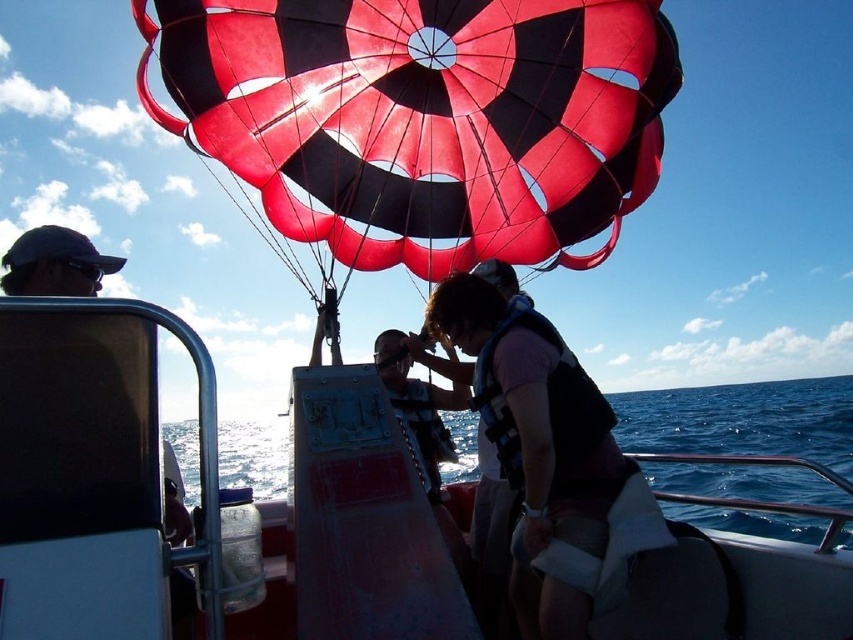
In the scene shown: You are on the boat deck and want to move from the point at coordinates point (785, 388) to the point at coordinates point (599, 497). Which direction should you move relative to the boat?

You should move forward relative to the boat because point (785, 388) is behind point (599, 497), so moving forward will take you towards the desired point.

You are standing on the deck of the boat and want to take a photo of the parasail. There are two points marked on the deck at coordinates point (9, 556) and point (274, 451). Which point is closer to you when you take the photo?

Point (9, 556) is closer to the camera than point (274, 451), so the point closer to you when taking the photo is point (9, 556).